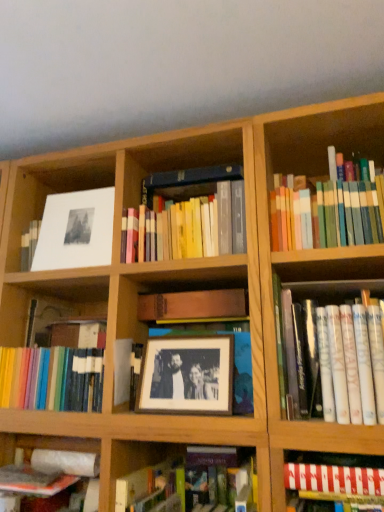
The image size is (384, 512). I want to click on white matte picture frame at upper left, the first picture frame positioned from the back, so click(x=76, y=230).

Image resolution: width=384 pixels, height=512 pixels. Describe the element at coordinates (187, 375) in the screenshot. I see `wooden picture frame at center, positioned as the 1th picture frame in right-to-left order` at that location.

Describe the element at coordinates (187, 216) in the screenshot. I see `hardcover books at center, the second book viewed from the top` at that location.

Locate an element on the screen. The height and width of the screenshot is (512, 384). hardcover book at center, which is the fourth book in top-to-bottom order is located at coordinates (56, 362).

Where is `white matte picture frame at upper left, the first picture frame positioned from the back`? This screenshot has width=384, height=512. white matte picture frame at upper left, the first picture frame positioned from the back is located at coordinates (76, 230).

From the image's perspective, which is above, hardcover books at center, the sixth book positioned from the bottom, or hardcover book at center, the 4th book from the bottom?

From the image's view, hardcover books at center, the sixth book positioned from the bottom, is above.

From the picture: In the image, is hardcover books at center, the sixth book positioned from the bottom, positioned in front of or behind hardcover book at center, the 4th book from the bottom?

In the image, hardcover books at center, the sixth book positioned from the bottom, appears in front of hardcover book at center, the 4th book from the bottom.

Which of these two, hardcover books at center, the sixth book positioned from the bottom, or hardcover book at center, which is the fourth book in top-to-bottom order, stands taller?

hardcover book at center, which is the fourth book in top-to-bottom order.

Is hardcover books at center, the sixth book positioned from the bottom, touching hardcover book at center, which is the fourth book in top-to-bottom order?

No, hardcover books at center, the sixth book positioned from the bottom, is not next to hardcover book at center, which is the fourth book in top-to-bottom order.

Looking at this image, from the image's perspective, is white paperback book at right, the third book positioned from the top, positioned above or below hardcover book at center, which is the fourth book in top-to-bottom order?

Clearly, from the image's perspective, white paperback book at right, the third book positioned from the top, is above hardcover book at center, which is the fourth book in top-to-bottom order.

Locate an element on the screen. the 5th book in front of the hardcover book at center, which is the fourth book in top-to-bottom order is located at coordinates (348, 360).

Which of these two, white paperback book at right, the fifth book positioned from the bottom, or hardcover book at center, which is the fourth book in top-to-bottom order, is thinner?

With smaller width is hardcover book at center, which is the fourth book in top-to-bottom order.

How much distance is there between white paperback book at right, the third book positioned from the top, and hardcover book at center, the 4th book from the bottom?

They are 25.60 inches apart.

Is white matte picture frame at upper left, the first picture frame from the left, inside or outside of wooden frame at center?

white matte picture frame at upper left, the first picture frame from the left, cannot be found inside wooden frame at center.

From the image's perspective, is white matte picture frame at upper left, placed as the 2th picture frame when sorted from right to left, beneath wooden frame at center?

No, from the image's perspective, white matte picture frame at upper left, placed as the 2th picture frame when sorted from right to left, is not below wooden frame at center.

Measure the distance between white matte picture frame at upper left, the first picture frame from the left, and wooden frame at center.

The distance of white matte picture frame at upper left, the first picture frame from the left, from wooden frame at center is 10.07 inches.

From a real-world perspective, which is physically above, white matte picture frame at upper left, the first picture frame from the left, or wooden frame at center?

In real-world perspective, white matte picture frame at upper left, the first picture frame from the left, is above.

Can you tell me how much white paperback book at right, the third book positioned from the top, and striped paper book at lower right, which appears as the third book when ordered from the bottom, differ in facing direction?

white paperback book at right, the third book positioned from the top, and striped paper book at lower right, which appears as the third book when ordered from the bottom, are facing 0.000532 degrees away from each other.

Which object is thinner, white paperback book at right, the fifth book positioned from the bottom, or striped paper book at lower right, which appears as the third book when ordered from the bottom?

Thinner between the two is striped paper book at lower right, which appears as the third book when ordered from the bottom.

How distant is white paperback book at right, the third book positioned from the top, from striped paper book at lower right, which appears as the third book when ordered from the bottom?

A distance of 7.40 inches exists between white paperback book at right, the third book positioned from the top, and striped paper book at lower right, which appears as the third book when ordered from the bottom.

Is point (340, 373) closer to viewer compared to point (327, 490)?

No, (340, 373) is behind (327, 490).

Is wooden frame at center with hardcover book at lower center, placed as the sixth book when sorted from top to bottom?

No, wooden frame at center is not beside hardcover book at lower center, placed as the sixth book when sorted from top to bottom.

Is wooden frame at center surrounding hardcover book at lower center, the second book in the bottom-to-top sequence?

No.

Considering the relative positions of wooden frame at center and hardcover book at lower center, the second book in the bottom-to-top sequence, in the image provided, is wooden frame at center to the right of hardcover book at lower center, the second book in the bottom-to-top sequence, from the viewer's perspective?

Yes, wooden frame at center is to the right of hardcover book at lower center, the second book in the bottom-to-top sequence.

Does wooden frame at center have a smaller size compared to hardcover book at lower center, placed as the sixth book when sorted from top to bottom?

Incorrect, wooden frame at center is not smaller in size than hardcover book at lower center, placed as the sixth book when sorted from top to bottom.

Can you confirm if hardcover book at lower left, placed as the 1th book when sorted from bottom to top, is bigger than white matte picture frame at upper left, the first picture frame from the left?

Indeed, hardcover book at lower left, placed as the 1th book when sorted from bottom to top, has a larger size compared to white matte picture frame at upper left, the first picture frame from the left.

From a real-world perspective, which picture frame is the 2nd one above the hardcover book at lower left, placed as the 1th book when sorted from bottom to top? Please provide its 2D coordinates.

[(76, 230)]

Consider the image. Does hardcover book at lower left, placed as the 1th book when sorted from bottom to top, come behind white matte picture frame at upper left, placed as the 2th picture frame when sorted from right to left?

No.

From a real-world perspective, is hardcover book at lower left, placed as the 1th book when sorted from bottom to top, physically below white matte picture frame at upper left, the first picture frame positioned from the back?

Yes.

Does hardcover books at upper right, which appears as the seventh book when ordered from the bottom, touch hardcover books at center, the second book viewed from the top?

No, hardcover books at upper right, which appears as the seventh book when ordered from the bottom, is not next to hardcover books at center, the second book viewed from the top.

Considering their positions, is hardcover books at upper right, the 1th book in the top-to-bottom sequence, located in front of or behind hardcover books at center, the second book viewed from the top?

Visually, hardcover books at upper right, the 1th book in the top-to-bottom sequence, is located in front of hardcover books at center, the second book viewed from the top.

From the image's perspective, which is above, hardcover books at upper right, which appears as the seventh book when ordered from the bottom, or hardcover books at center, the second book viewed from the top?

hardcover books at upper right, which appears as the seventh book when ordered from the bottom, is shown above in the image.

Is hardcover books at center, the second book viewed from the top, completely or partially inside hardcover books at upper right, the 1th book in the top-to-bottom sequence?

No.

Locate an element on the screen. The width and height of the screenshot is (384, 512). the 2nd book to the left of the hardcover books at center, the second book viewed from the top, counting from the anchor's position is located at coordinates (56, 362).

I want to click on book that is the 5th object located in front of the hardcover book at center, the 4th book from the bottom, so click(348, 360).

When comparing their distances from hardcover book at center, which is the fourth book in top-to-bottom order, does striped paper book at lower right, which appears as the third book when ordered from the bottom, or white matte picture frame at upper left, which ranks as the first picture frame in top-to-bottom order, seem closer?

white matte picture frame at upper left, which ranks as the first picture frame in top-to-bottom order, is closer to hardcover book at center, which is the fourth book in top-to-bottom order.

When comparing their distances from white matte picture frame at upper left, which ranks as the first picture frame in top-to-bottom order, does hardcover book at lower center, the second book in the bottom-to-top sequence, or hardcover books at center, the second book viewed from the top, seem closer?

hardcover books at center, the second book viewed from the top, lies closer to white matte picture frame at upper left, which ranks as the first picture frame in top-to-bottom order, than the other object.

Considering their positions, is hardcover book at lower center, placed as the sixth book when sorted from top to bottom, positioned closer to hardcover books at upper right, which appears as the seventh book when ordered from the bottom, than striped paper book at lower right, the fifth book positioned from the top?

The object closer to hardcover books at upper right, which appears as the seventh book when ordered from the bottom, is striped paper book at lower right, the fifth book positioned from the top.

Looking at the image, which one is located closer to striped paper book at lower right, which appears as the third book when ordered from the bottom, hardcover books at upper right, the 1th book in the top-to-bottom sequence, or hardcover book at lower left, marked as the seventh book in a top-to-bottom arrangement?

The object closer to striped paper book at lower right, which appears as the third book when ordered from the bottom, is hardcover books at upper right, the 1th book in the top-to-bottom sequence.

Looking at the image, which one is located further to hardcover books at center, the sixth book positioned from the bottom, white matte picture frame at upper left, positioned as the 2th picture frame in front-to-back order, or hardcover book at center, which is the fourth book in top-to-bottom order?

hardcover book at center, which is the fourth book in top-to-bottom order.

Estimate the real-world distances between objects in this image. Which object is closer to wooden picture frame at center, positioned as the 1th picture frame in right-to-left order, hardcover book at lower center, the second book in the bottom-to-top sequence, or hardcover books at center, the sixth book positioned from the bottom?

hardcover book at lower center, the second book in the bottom-to-top sequence, lies closer to wooden picture frame at center, positioned as the 1th picture frame in right-to-left order, than the other object.

Based on their spatial positions, is white paperback book at right, the third book positioned from the top, or wooden picture frame at center, the 1th picture frame positioned from the front, closer to hardcover book at center, the 4th book from the bottom?

wooden picture frame at center, the 1th picture frame positioned from the front, is closer to hardcover book at center, the 4th book from the bottom.

Considering their positions, is white matte picture frame at upper left, the first picture frame positioned from the back, positioned further to hardcover books at upper right, the 1th book in the top-to-bottom sequence, than hardcover books at center, the second book viewed from the top?

Among the two, white matte picture frame at upper left, the first picture frame positioned from the back, is located further to hardcover books at upper right, the 1th book in the top-to-bottom sequence.

Identify the location of cabinet situated between white matte picture frame at upper left, the second picture frame when ordered from bottom to top, and striped paper book at lower right, the fifth book positioned from the top, from left to right. This screenshot has width=384, height=512. (194, 306).

Where is `cabinet between white matte picture frame at upper left, the first picture frame from the left, and hardcover book at lower center, the second book in the bottom-to-top sequence, in the up-down direction`? The width and height of the screenshot is (384, 512). cabinet between white matte picture frame at upper left, the first picture frame from the left, and hardcover book at lower center, the second book in the bottom-to-top sequence, in the up-down direction is located at coordinates (194, 306).

Identify the location of cabinet between white matte picture frame at upper left, the second picture frame when ordered from bottom to top, and hardcover book at lower left, marked as the seventh book in a top-to-bottom arrangement, from top to bottom. The height and width of the screenshot is (512, 384). (194, 306).

Locate an element on the screen. The image size is (384, 512). picture frame between hardcover books at center, the sixth book positioned from the bottom, and hardcover book at center, which is the fourth book in top-to-bottom order, in the vertical direction is located at coordinates (187, 375).